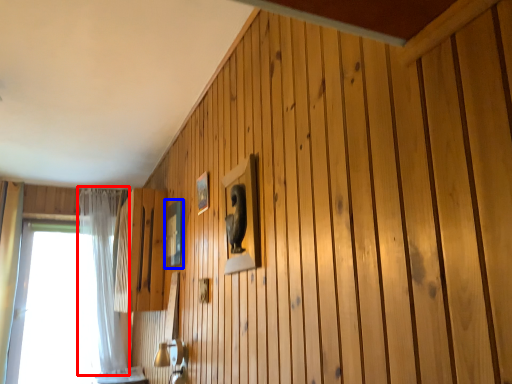
Question: Which object is closer to the camera taking this photo, curtain (highlighted by a red box) or picture frame (highlighted by a blue box)?

Choices:
 (A) curtain
 (B) picture frame

Answer: (B)